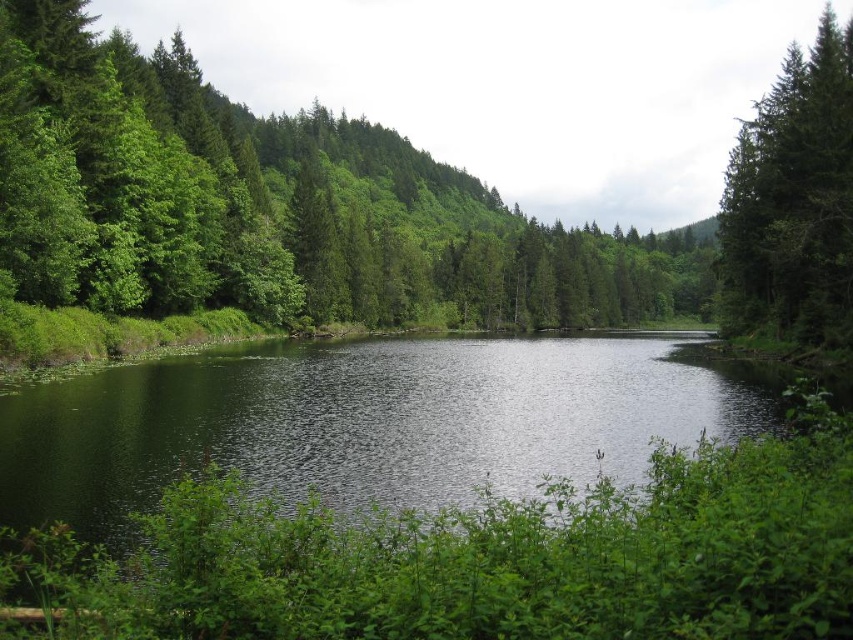
Question: Is green smooth water at center closer to the viewer compared to green matte tree at upper right?

Choices:
 (A) no
 (B) yes

Answer: (B)

Question: Which point is closer to the camera taking this photo?

Choices:
 (A) (103, 508)
 (B) (846, 77)

Answer: (A)

Question: Which is nearer to the green matte tree at center?

Choices:
 (A) green smooth water at center
 (B) green matte tree at upper right

Answer: (B)

Question: Which of the following is the closest to the observer?

Choices:
 (A) click(125, 70)
 (B) click(520, 417)
 (C) click(770, 116)

Answer: (B)

Question: Does green matte tree at center appear under green smooth water at center?

Choices:
 (A) no
 (B) yes

Answer: (A)

Question: Is green matte tree at center positioned behind green matte tree at upper right?

Choices:
 (A) yes
 (B) no

Answer: (B)